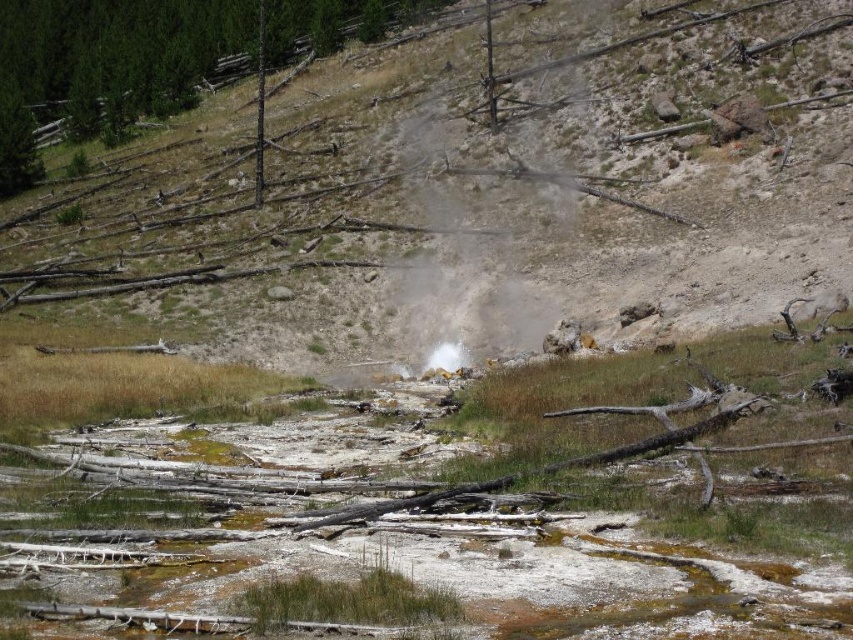
You are a geologist examining the yellowish rock at center and the green matte tree at upper left in the image. Which object is taller?

The yellowish rock at center is taller than the green matte tree at upper left according to the description.

You are a geologist examining the image. You need to determine which object is wider between the yellowish rock at center and the green matte tree at upper left. Based on the scene, which one is wider?

The yellowish rock at center is wider than the green matte tree at upper left according to the description.

You are a hiker standing at the edge of this geothermal area. You see the yellowish rock at center and the green matte tree at upper left. Which object is closer to you?

The yellowish rock at center is closer to you because it is in front of the green matte tree at upper left.